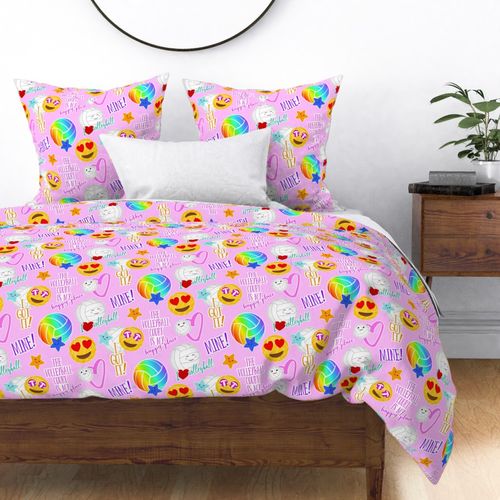
At what (x,y) coordinates should I click in order to perform the action: click on decorative plant. Please return your answer as a coordinate pair (x, y). Looking at the image, I should click on (491, 170).